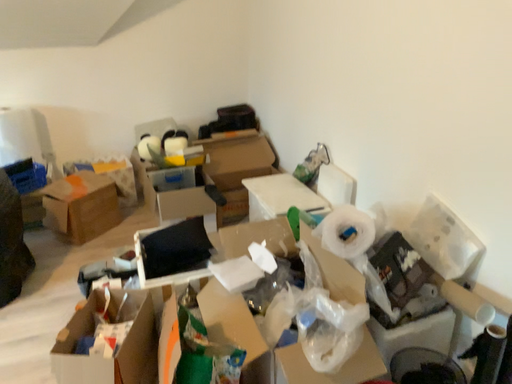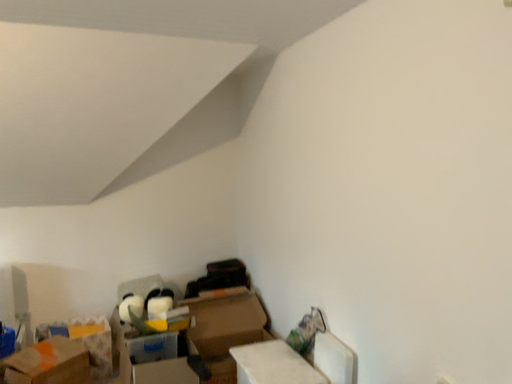
Question: Which way did the camera rotate in the video?

Choices:
 (A) rotated upward
 (B) rotated downward

Answer: (A)